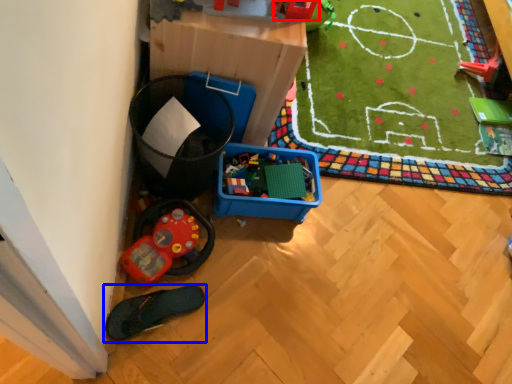
Question: Which object appears farthest to the camera in this image, toy (highlighted by a red box) or footwear (highlighted by a blue box)?

Choices:
 (A) toy
 (B) footwear

Answer: (B)